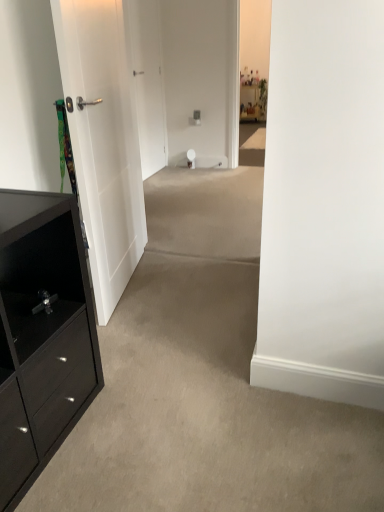
What is the approximate width of black matte cabinet at left?

black matte cabinet at left is 16.23 inches in width.

Find the location of `white matte door at left, arranged as the first door when viewed from the front`. white matte door at left, arranged as the first door when viewed from the front is located at coordinates (103, 140).

In order to click on black matte cabinet at left in this screenshot , I will do `click(46, 319)`.

Is white matte door at left, arranged as the first door when viewed from the front, situated inside white smooth door at center, the second door in the front-to-back sequence, or outside?

The correct answer is: outside.

Is white matte door at left, arranged as the first door when viewed from the front, taller than white smooth door at center, the second door in the front-to-back sequence?

Incorrect, the height of white matte door at left, arranged as the first door when viewed from the front, is not larger of that of white smooth door at center, the second door in the front-to-back sequence.

From the picture: Is the surface of white matte door at left, arranged as the second door when viewed from the back, in direct contact with white smooth door at center, the second door in the front-to-back sequence?

white matte door at left, arranged as the second door when viewed from the back, and white smooth door at center, the second door in the front-to-back sequence, are not in contact.

Between white matte door at left, arranged as the first door when viewed from the front, and white smooth door at center, which is the 1th door from back to front, which one has larger size?

Bigger between the two is white matte door at left, arranged as the first door when viewed from the front.

Is point (139, 111) closer or farther from the camera than point (122, 11)?

Point (139, 111) is positioned farther from the camera compared to point (122, 11).

Does white smooth door at center, the second door in the front-to-back sequence, touch white matte door at left, arranged as the second door when viewed from the back?

No, white smooth door at center, the second door in the front-to-back sequence, is not next to white matte door at left, arranged as the second door when viewed from the back.

Is white smooth door at center, the second door in the front-to-back sequence, looking in the opposite direction of white matte door at left, arranged as the second door when viewed from the back?

No, white smooth door at center, the second door in the front-to-back sequence, is not facing the opposite direction of white matte door at left, arranged as the second door when viewed from the back.

From the image's perspective, between white smooth door at center, which is the 1th door from back to front, and white matte door at left, arranged as the second door when viewed from the back, which one is located above?

From the image's view, white smooth door at center, which is the 1th door from back to front, is above.

Who is shorter, white smooth door at center, the second door in the front-to-back sequence, or black matte cabinet at left?

With less height is black matte cabinet at left.

In the image, is white smooth door at center, the second door in the front-to-back sequence, on the left side or the right side of black matte cabinet at left?

Based on their positions, white smooth door at center, the second door in the front-to-back sequence, is located to the right of black matte cabinet at left.

Does white smooth door at center, the second door in the front-to-back sequence, have a smaller size compared to black matte cabinet at left?

Yes.

Can you tell me how much black matte cabinet at left and white matte door at left, arranged as the second door when viewed from the back, differ in facing direction?

The facing directions of black matte cabinet at left and white matte door at left, arranged as the second door when viewed from the back, are 11.6 degrees apart.

In terms of size, does black matte cabinet at left appear bigger or smaller than white matte door at left, arranged as the second door when viewed from the back?

black matte cabinet at left is bigger than white matte door at left, arranged as the second door when viewed from the back.

From the black matte cabinet at left, count 1st doors backward and point to it. Please provide its 2D coordinates.

[(103, 140)]

How far apart are black matte cabinet at left and white matte door at left, arranged as the second door when viewed from the back?

black matte cabinet at left is 27.80 inches away from white matte door at left, arranged as the second door when viewed from the back.

Which point is more distant from viewer, (61,18) or (54,234)?

The point (61,18) is more distant.

Can black matte cabinet at left be found inside white matte door at left, arranged as the first door when viewed from the front?

No, black matte cabinet at left is not surrounded by white matte door at left, arranged as the first door when viewed from the front.

From a real-world perspective, which object rests below the other?

black matte cabinet at left, from a real-world perspective.

Is black matte cabinet at left oriented away from white smooth door at center, which is the 1th door from back to front?

That's not correct — black matte cabinet at left is not looking away from white smooth door at center, which is the 1th door from back to front.

Between black matte cabinet at left and white smooth door at center, the second door in the front-to-back sequence, which one has larger width?

black matte cabinet at left.

Is black matte cabinet at left not near white smooth door at center, which is the 1th door from back to front?

Indeed, black matte cabinet at left is not near white smooth door at center, which is the 1th door from back to front.

This screenshot has width=384, height=512. Find the location of `door lying in front of the white smooth door at center, which is the 1th door from back to front`. door lying in front of the white smooth door at center, which is the 1th door from back to front is located at coordinates (103, 140).

This screenshot has width=384, height=512. In the image, there is a white smooth door at center, the second door in the front-to-back sequence. Find the location of `door below it (from the image's perspective)`. door below it (from the image's perspective) is located at coordinates (103, 140).

Based on their spatial positions, is white matte door at left, arranged as the first door when viewed from the front, or white smooth door at center, the second door in the front-to-back sequence, closer to black matte cabinet at left?

white matte door at left, arranged as the first door when viewed from the front, lies closer to black matte cabinet at left than the other object.

When comparing their distances from white matte door at left, arranged as the second door when viewed from the back, does black matte cabinet at left or white smooth door at center, which is the 1th door from back to front, seem further?

white smooth door at center, which is the 1th door from back to front, is positioned further to the anchor white matte door at left, arranged as the second door when viewed from the back.

From the image, which object appears to be farther from white smooth door at center, which is the 1th door from back to front, black matte cabinet at left or white matte door at left, arranged as the first door when viewed from the front?

black matte cabinet at left.

Which object lies further to the anchor point white matte door at left, arranged as the first door when viewed from the front, white smooth door at center, the second door in the front-to-back sequence, or black matte cabinet at left?

white smooth door at center, the second door in the front-to-back sequence, is further to white matte door at left, arranged as the first door when viewed from the front.

Estimate the real-world distances between objects in this image. Which object is closer to white smooth door at center, the second door in the front-to-back sequence, white matte door at left, arranged as the second door when viewed from the back, or black matte cabinet at left?

white matte door at left, arranged as the second door when viewed from the back.

Based on their spatial positions, is white smooth door at center, the second door in the front-to-back sequence, or white matte door at left, arranged as the second door when viewed from the back, further from black matte cabinet at left?

white smooth door at center, the second door in the front-to-back sequence, is further to black matte cabinet at left.

The height and width of the screenshot is (512, 384). I want to click on door between black matte cabinet at left and white smooth door at center, which is the 1th door from back to front, from front to back, so click(103, 140).